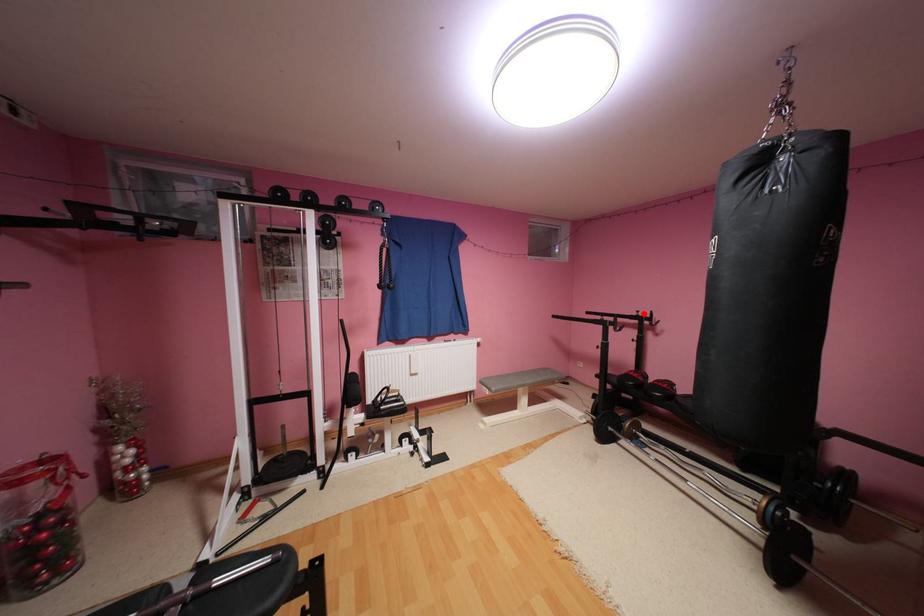
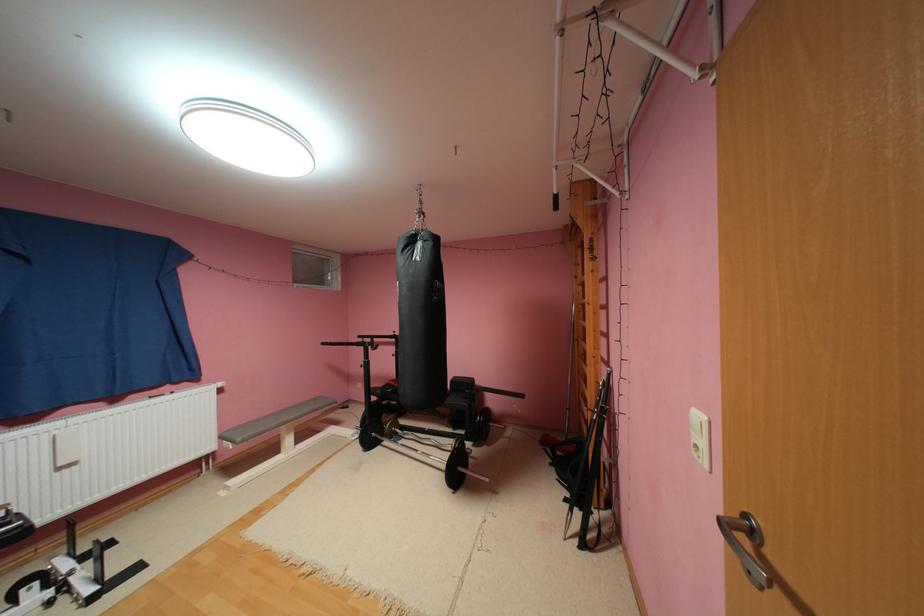
Find the pixel in the second image that matches the highlighted location in the first image.

(400, 334)